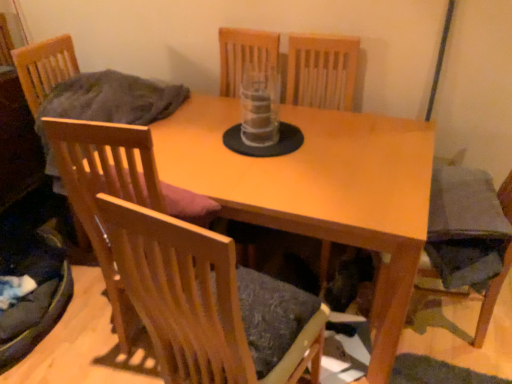
Locate an element on the screen. vacant area that is in front of transparent plastic vase at center is located at coordinates [248, 162].